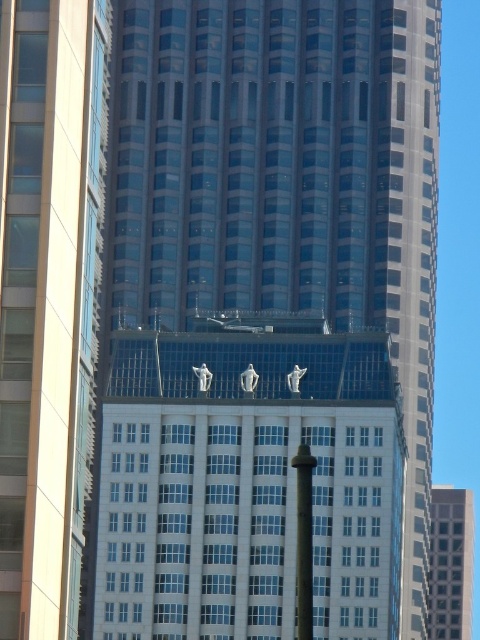
Question: Is the position of white glass building at center less distant than that of glassy reflective skyscraper at center?

Choices:
 (A) yes
 (B) no

Answer: (A)

Question: Considering the relative positions of white glass building at center and glassy reflective skyscraper at center in the image provided, where is white glass building at center located with respect to glassy reflective skyscraper at center?

Choices:
 (A) below
 (B) above

Answer: (B)

Question: Which of the following is the farthest from the observer?

Choices:
 (A) (6, 246)
 (B) (383, 337)
 (C) (457, 502)

Answer: (C)

Question: Does white glass building at center appear on the right side of glassy reflective skyscraper at center?

Choices:
 (A) no
 (B) yes

Answer: (A)

Question: Which point is farther to the camera?

Choices:
 (A) (463, 628)
 (B) (84, 19)
 (C) (379, 342)

Answer: (A)

Question: Which object is the farthest from the white glass building at center?

Choices:
 (A) glassy reflective skyscraper at center
 (B) glassy steel skyscraper at center

Answer: (B)